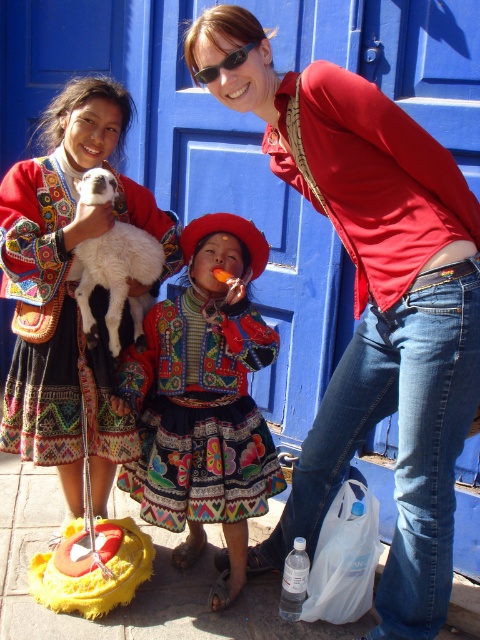
Can you confirm if matte red shirt at upper right is shorter than black plastic sunglasses at upper center?

No, matte red shirt at upper right is not shorter than black plastic sunglasses at upper center.

Which is in front, point (424, 566) or point (197, 81)?

Point (424, 566) is more forward.

Find the location of `matte red shirt at upper right`. matte red shirt at upper right is located at coordinates (372, 301).

Is point (79, 186) farther from camera compared to point (244, 49)?

Yes.

Does white fluffy lamb at upper left have a smaller size compared to black plastic sunglasses at upper center?

Incorrect, white fluffy lamb at upper left is not smaller in size than black plastic sunglasses at upper center.

The height and width of the screenshot is (640, 480). In order to click on white fluffy lamb at upper left in this screenshot , I will do `click(118, 280)`.

Can you confirm if matte red shirt at upper right is bigger than white fluffy lamb at upper left?

Yes.

Can you confirm if matte red shirt at upper right is positioned to the right of white fluffy lamb at upper left?

Yes, matte red shirt at upper right is to the right of white fluffy lamb at upper left.

Between point (352, 337) and point (113, 180), which one is positioned in front?

Point (352, 337) is more forward.

You are a GUI agent. You are given a task and a screenshot of the screen. Output one action in this format:
    pyautogui.click(x=<x>, y=<y>)
    Task: Click on the matte red shirt at upper right
    
    Given the screenshot: What is the action you would take?
    pyautogui.click(x=372, y=301)